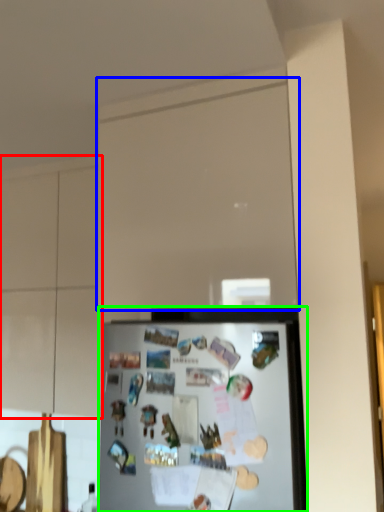
Question: Which object is the closest to the cabinetry (highlighted by a red box)? Choose among these: glass door (highlighted by a blue box) or refrigerator (highlighted by a green box).

Choices:
 (A) glass door
 (B) refrigerator

Answer: (A)